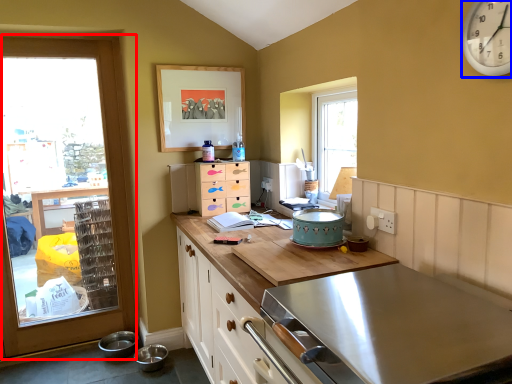
Question: Which point is further to the camera, door (highlighted by a red box) or clock (highlighted by a blue box)?

Choices:
 (A) door
 (B) clock

Answer: (A)